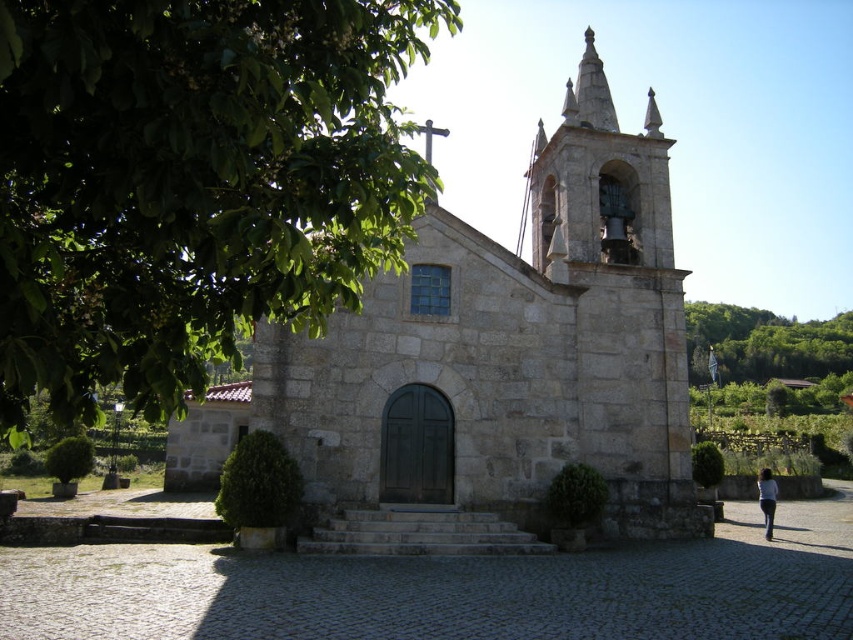
Is stone church at center smaller than white fabric person at lower right?

Actually, stone church at center might be larger than white fabric person at lower right.

Find the location of a particular element. The width and height of the screenshot is (853, 640). stone church at center is located at coordinates (494, 358).

Who is more forward, (569,352) or (717,380)?

Positioned in front is point (569,352).

Locate an element on the screen. The width and height of the screenshot is (853, 640). stone church at center is located at coordinates (494, 358).

Which of these two, stone church at center or dark blue fabric at lower right, stands taller?

Standing taller between the two is stone church at center.

What do you see at coordinates (494, 358) in the screenshot? The height and width of the screenshot is (640, 853). I see `stone church at center` at bounding box center [494, 358].

You are a GUI agent. You are given a task and a screenshot of the screen. Output one action in this format:
    pyautogui.click(x=<x>, y=<y>)
    Task: Click on the stone church at center
    The width and height of the screenshot is (853, 640).
    Given the screenshot: What is the action you would take?
    pyautogui.click(x=494, y=358)

Is green leafy tree at upper left thinner than dark blue fabric at lower right?

Indeed, green leafy tree at upper left has a lesser width compared to dark blue fabric at lower right.

Can you confirm if green leafy tree at upper left is positioned above dark blue fabric at lower right?

Indeed, green leafy tree at upper left is positioned over dark blue fabric at lower right.

Is point (397, 35) positioned before point (766, 536)?

Yes, point (397, 35) is in front of point (766, 536).

Image resolution: width=853 pixels, height=640 pixels. I want to click on green leafy tree at upper left, so click(190, 182).